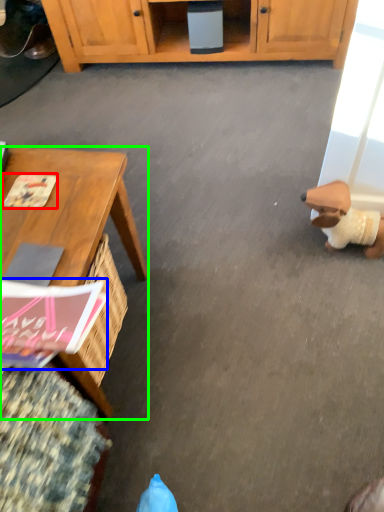
Question: Which object is positioned closest to magazine (highlighted by a red box)? Select from magazine (highlighted by a blue box) and desk (highlighted by a green box).

Choices:
 (A) magazine
 (B) desk

Answer: (B)